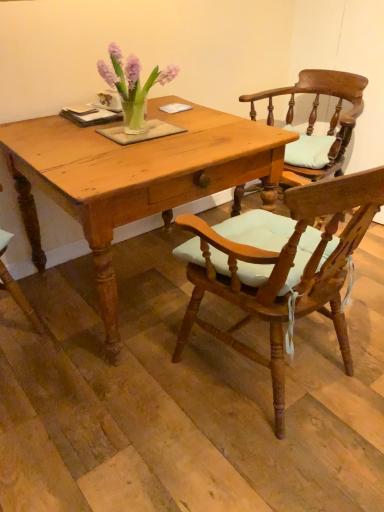
Where is `light brown wooden table at center`? This screenshot has width=384, height=512. light brown wooden table at center is located at coordinates (135, 178).

Image resolution: width=384 pixels, height=512 pixels. I want to click on chair in front of the light brown wooden table at center, so (x=280, y=268).

Is wooden chair with light blue cushion at center, which appears as the first chair when viewed from the front, to the left or to the right of light brown wooden table at center in the image?

wooden chair with light blue cushion at center, which appears as the first chair when viewed from the front, is to the right of light brown wooden table at center.

From the image's perspective, between wooden chair with light blue cushion at center, which appears as the first chair when viewed from the front, and light brown wooden table at center, which one is located above?

light brown wooden table at center is shown above in the image.

Based on the photo, which is less distant, (302, 84) or (37, 224)?

The point (37, 224) is closer.

Can you confirm if wooden chair with cushion at center, placed as the 1th chair when sorted from back to front, is taller than light brown wooden table at center?

No, wooden chair with cushion at center, placed as the 1th chair when sorted from back to front, is not taller than light brown wooden table at center.

Would you say wooden chair with cushion at center, which is counted as the second chair, starting from the front, is outside light brown wooden table at center?

Yes, wooden chair with cushion at center, which is counted as the second chair, starting from the front, is outside of light brown wooden table at center.

From a real-world perspective, between wooden chair with cushion at center, which is counted as the second chair, starting from the front, and light brown wooden table at center, who is vertically higher?

wooden chair with cushion at center, which is counted as the second chair, starting from the front.

Looking at this image, how different are the orientations of light brown wooden table at center and wooden chair with cushion at center, placed as the 1th chair when sorted from back to front, in degrees?

79.9 degrees.

Considering the sizes of light brown wooden table at center and wooden chair with cushion at center, which is counted as the second chair, starting from the front, in the image, is light brown wooden table at center bigger or smaller than wooden chair with cushion at center, which is counted as the second chair, starting from the front,?

Clearly, light brown wooden table at center is larger in size than wooden chair with cushion at center, which is counted as the second chair, starting from the front.

Can you confirm if light brown wooden table at center is wider than wooden chair with cushion at center, which is counted as the second chair, starting from the front?

Yes, light brown wooden table at center is wider than wooden chair with cushion at center, which is counted as the second chair, starting from the front.

Is wooden chair with cushion at center, placed as the 1th chair when sorted from back to front, located within light brown wooden table at center?

No, wooden chair with cushion at center, placed as the 1th chair when sorted from back to front, is not inside light brown wooden table at center.

Locate an element on the screen. This screenshot has height=512, width=384. chair behind the wooden chair with light blue cushion at center, which appears as the first chair when viewed from the front is located at coordinates point(316,124).

Between wooden chair with cushion at center, placed as the 1th chair when sorted from back to front, and wooden chair with light blue cushion at center, which ranks as the second chair in back-to-front order, which one has more height?

Standing taller between the two is wooden chair with light blue cushion at center, which ranks as the second chair in back-to-front order.

Are wooden chair with cushion at center, placed as the 1th chair when sorted from back to front, and wooden chair with light blue cushion at center, which appears as the first chair when viewed from the front, located far from each other?

A: No, there isn't a large distance between wooden chair with cushion at center, placed as the 1th chair when sorted from back to front, and wooden chair with light blue cushion at center, which appears as the first chair when viewed from the front.

Does wooden chair with cushion at center, which is counted as the second chair, starting from the front, have a smaller size compared to wooden chair with light blue cushion at center, which ranks as the second chair in back-to-front order?

Yes, wooden chair with cushion at center, which is counted as the second chair, starting from the front, is smaller than wooden chair with light blue cushion at center, which ranks as the second chair in back-to-front order.

Is point (357, 217) farther from viewer compared to point (329, 73)?

That is False.

Can you confirm if wooden chair with light blue cushion at center, which appears as the first chair when viewed from the front, is taller than wooden chair with cushion at center, placed as the 1th chair when sorted from back to front?

Indeed, wooden chair with light blue cushion at center, which appears as the first chair when viewed from the front, has a greater height compared to wooden chair with cushion at center, placed as the 1th chair when sorted from back to front.

From the image's perspective, which is above, wooden chair with light blue cushion at center, which appears as the first chair when viewed from the front, or wooden chair with cushion at center, which is counted as the second chair, starting from the front?

From the image's view, wooden chair with cushion at center, which is counted as the second chair, starting from the front, is above.

Between wooden chair with light blue cushion at center, which appears as the first chair when viewed from the front, and wooden chair with cushion at center, which is counted as the second chair, starting from the front, which one appears on the right side from the viewer's perspective?

wooden chair with cushion at center, which is counted as the second chair, starting from the front, is more to the right.

Is the position of light brown wooden table at center more distant than that of wooden chair with light blue cushion at center, which appears as the first chair when viewed from the front?

Yes, light brown wooden table at center is further from the camera.

Is light brown wooden table at center facing away from wooden chair with light blue cushion at center, which appears as the first chair when viewed from the front?

That's not correct — light brown wooden table at center is not looking away from wooden chair with light blue cushion at center, which appears as the first chair when viewed from the front.

From a real-world perspective, is light brown wooden table at center above or below wooden chair with light blue cushion at center, which appears as the first chair when viewed from the front?

light brown wooden table at center is situated lower than wooden chair with light blue cushion at center, which appears as the first chair when viewed from the front, in the real world.

Is light brown wooden table at center bigger or smaller than wooden chair with light blue cushion at center, which appears as the first chair when viewed from the front?

In the image, light brown wooden table at center appears to be larger than wooden chair with light blue cushion at center, which appears as the first chair when viewed from the front.

At what (x,y) coordinates should I click in order to perform the action: click on chair that appears below the light brown wooden table at center (from the image's perspective). Please return your answer as a coordinate pair (x, y). Looking at the image, I should click on (280, 268).

The width and height of the screenshot is (384, 512). There is a light brown wooden table at center. What are the coordinates of `the 2nd chair above it (from a real-world perspective)` in the screenshot? It's located at (316, 124).

Estimate the real-world distances between objects in this image. Which object is closer to light brown wooden table at center, wooden chair with light blue cushion at center, which appears as the first chair when viewed from the front, or wooden chair with cushion at center, which is counted as the second chair, starting from the front?

Based on the image, wooden chair with light blue cushion at center, which appears as the first chair when viewed from the front, appears to be nearer to light brown wooden table at center.

From the image, which object appears to be nearer to light brown wooden table at center, wooden chair with cushion at center, placed as the 1th chair when sorted from back to front, or wooden chair with light blue cushion at center, which ranks as the second chair in back-to-front order?

wooden chair with light blue cushion at center, which ranks as the second chair in back-to-front order, lies closer to light brown wooden table at center than the other object.

Estimate the real-world distances between objects in this image. Which object is closer to wooden chair with cushion at center, which is counted as the second chair, starting from the front, light brown wooden table at center or wooden chair with light blue cushion at center, which appears as the first chair when viewed from the front?

light brown wooden table at center is positioned closer to the anchor wooden chair with cushion at center, which is counted as the second chair, starting from the front.

Estimate the real-world distances between objects in this image. Which object is closer to wooden chair with cushion at center, which is counted as the second chair, starting from the front, wooden chair with light blue cushion at center, which appears as the first chair when viewed from the front, or light brown wooden table at center?

light brown wooden table at center.

Considering their positions, is wooden chair with cushion at center, which is counted as the second chair, starting from the front, positioned further to wooden chair with light blue cushion at center, which appears as the first chair when viewed from the front, than light brown wooden table at center?

Among the two, wooden chair with cushion at center, which is counted as the second chair, starting from the front, is located further to wooden chair with light blue cushion at center, which appears as the first chair when viewed from the front.

Based on their spatial positions, is light brown wooden table at center or wooden chair with cushion at center, which is counted as the second chair, starting from the front, closer to wooden chair with light blue cushion at center, which ranks as the second chair in back-to-front order?

Among the two, light brown wooden table at center is located nearer to wooden chair with light blue cushion at center, which ranks as the second chair in back-to-front order.

I want to click on table between wooden chair with light blue cushion at center, which appears as the first chair when viewed from the front, and wooden chair with cushion at center, placed as the 1th chair when sorted from back to front, along the z-axis, so click(135, 178).